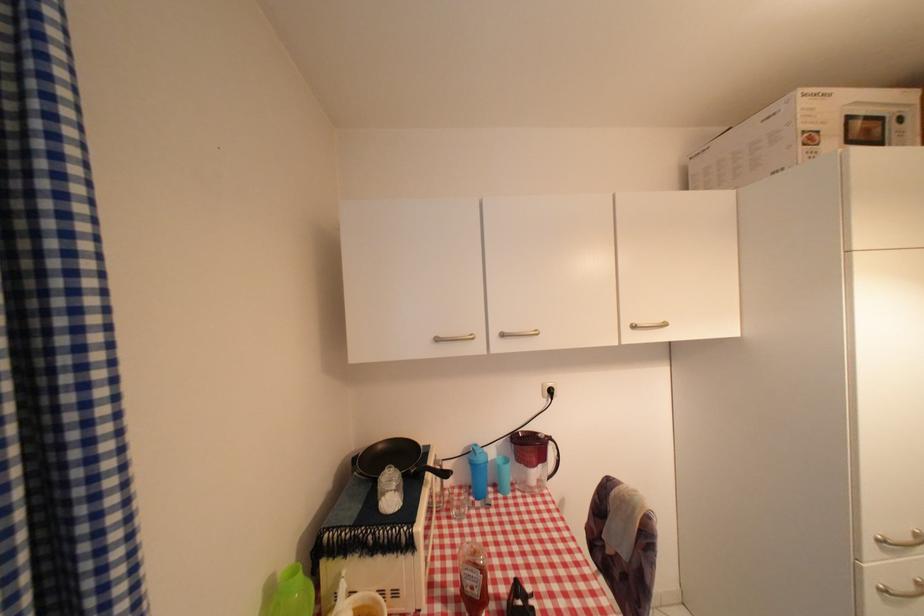
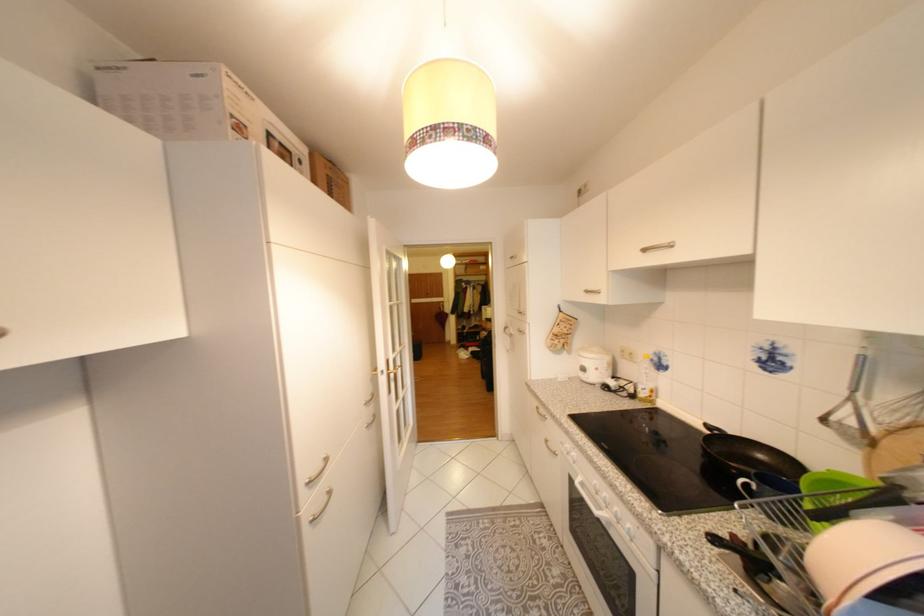
Locate, in the second image, the point that corresponds to the point at 880,532 in the first image.

(311, 482)